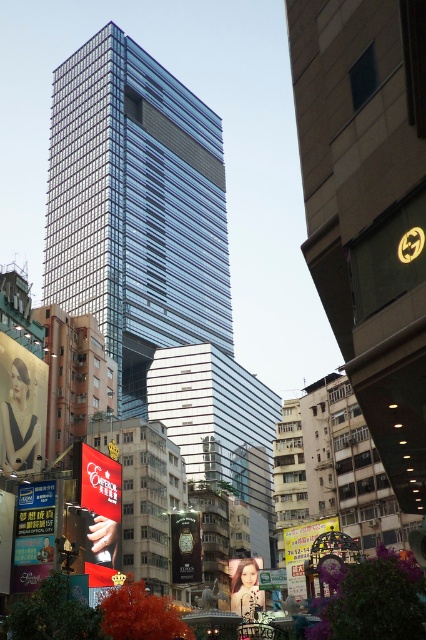
You are an architect analyzing the urban layout. From your vantage point, does the glassy metallic skyscraper at center block the view of the matte black billboard at lower left?

The glassy metallic skyscraper at center is above the matte black billboard at lower left, so it does block the view of the matte black billboard at lower left.

You are standing at the center of the image and want to locate the matte red billboard at lower left. According to its 2D coordinates, in which direction should you look to find it?

The matte red billboard at lower left is located at coordinates point [100,513]. Since the coordinates are in the lower left quadrant of the image, you should look to your lower left direction to find it.

You are a drone operator who needs to deliver a package from the glassy metallic skyscraper at center to the matte black billboard at lower left. The drone has a maximum flight range of 40 meters. Can the drone complete the delivery without needing a recharge?

The glassy metallic skyscraper at center is 40.79 meters away from the matte black billboard at lower left. Since the distance exceeds the drone s 40 meter range, the drone cannot complete the delivery without needing a recharge.